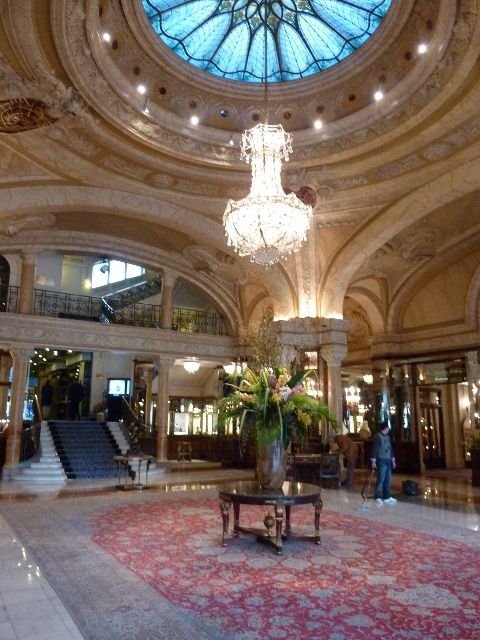
Question: Does blue stained glass dome at center have a larger size compared to crystal glass chandelier at center?

Choices:
 (A) no
 (B) yes

Answer: (A)

Question: Can you confirm if blue stained glass dome at center is bigger than crystal glass chandelier at center?

Choices:
 (A) yes
 (B) no

Answer: (B)

Question: Can you confirm if blue stained glass dome at center is positioned below crystal glass chandelier at center?

Choices:
 (A) no
 (B) yes

Answer: (A)

Question: Among these points, which one is nearest to the camera?

Choices:
 (A) (269, 161)
 (B) (215, 0)

Answer: (A)

Question: Among these points, which one is farthest from the camera?

Choices:
 (A) (176, 13)
 (B) (269, 132)

Answer: (A)

Question: Which of the following is the closest to the observer?

Choices:
 (A) (186, 29)
 (B) (256, 128)

Answer: (B)